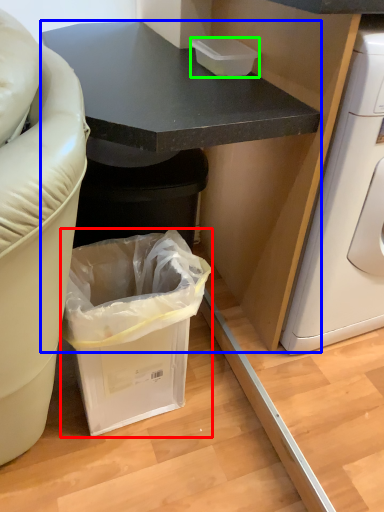
Question: Estimate the real-world distances between objects in this image. Which object is closer to trash bin/can (highlighted by a red box), cabinetry (highlighted by a blue box) or box (highlighted by a green box)?

Choices:
 (A) cabinetry
 (B) box

Answer: (A)